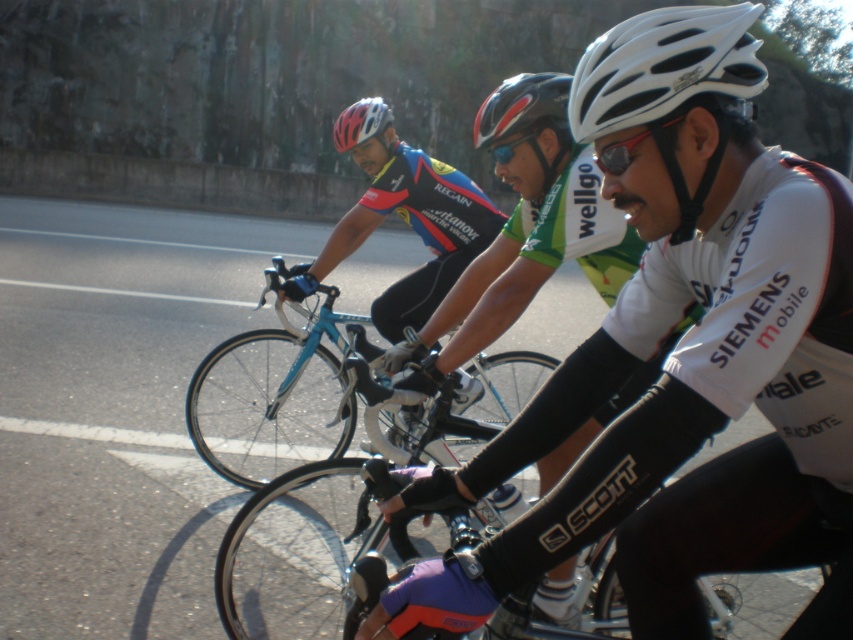
In the scene shown: You are a photographer standing at the side of the road capturing this cycling scene. You notice the purple matte bicycle handlebar at center and the matte white helmet at upper center. Which object is positioned lower in the image?

The purple matte bicycle handlebar at center has a lesser height compared to the matte white helmet at upper center, so the purple matte bicycle handlebar at center is positioned lower in the image.

You are a photographer trying to capture a closeup of the cyclist in the foreground wearing the white jersey with SIEMENS mobile. You have two focus points available at coordinates point [215,454] and point [549,90]. Which focus point should you use to ensure the cyclist in the foreground is in focus?

Point [215,454] is closer to the camera than point [549,90], so using point [215,454] will ensure the cyclist in the foreground is in focus.

You are a photographer trying to capture the purple matte bicycle handlebar at center in the scene. The camera is set to focus on the point at coordinates point (x=305, y=552). Will the purple matte bicycle handlebar at center be in focus?

The purple matte bicycle handlebar at center is located at point (x=305, y=552), so yes, the purple matte bicycle handlebar at center will be in focus since the camera is focused on that point.